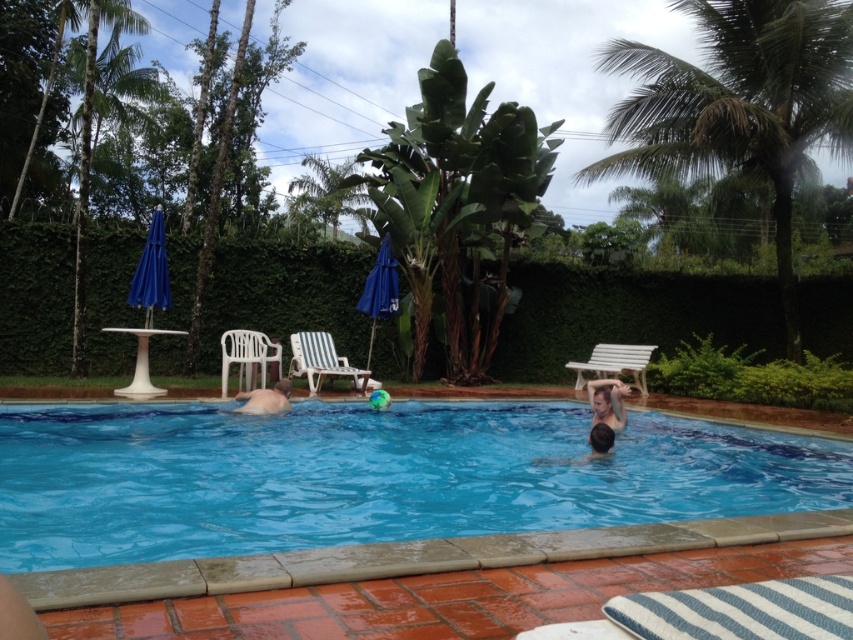
You are a photographer trying to capture a group photo of the smooth skin person at center and the fat man at center. Since you want to ensure both subjects are clearly visible, which person should you position closer to the camera to avoid being obscured by the other?

The smooth skin person at center is thinner than the fat man at center, so positioning the smooth skin person at center closer to the camera would help avoid them being obscured by the fat man at center.

You are planning to place a new bench in the pool area. The current white plastic bench at upper right is next to the green leafy palm tree at left. Which object is wider so that you can decide where to place the new bench?

The green leafy palm tree at left might be wider than the white plastic bench at upper right, so placing the new bench near the palm tree might require more space.